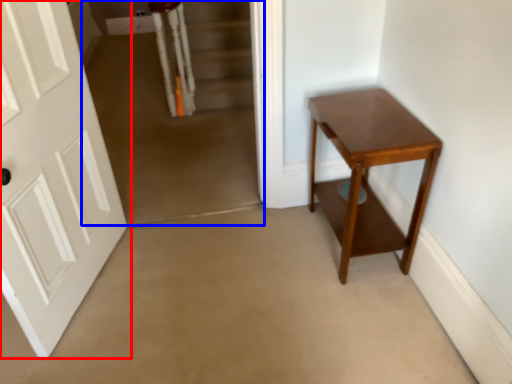
Question: Which of the following is the closest to the observer, door (highlighted by a red box) or corridor (highlighted by a blue box)?

Choices:
 (A) door
 (B) corridor

Answer: (A)